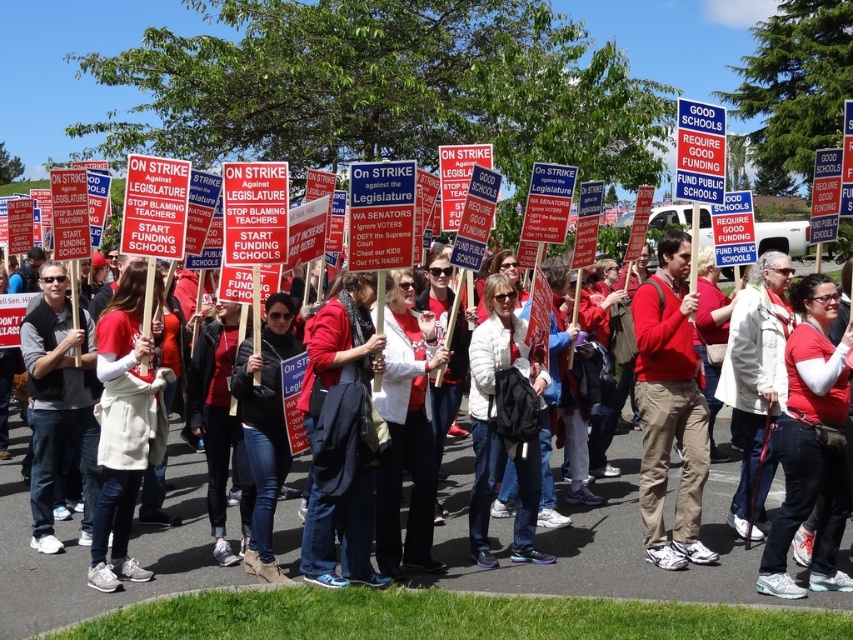
Does matte red sweater at center have a lesser height compared to gray vest at center?

No.

Can you confirm if matte red sweater at center is bigger than gray vest at center?

Actually, matte red sweater at center might be smaller than gray vest at center.

Where is `matte red sweater at center`? This screenshot has width=853, height=640. matte red sweater at center is located at coordinates (670, 406).

This screenshot has width=853, height=640. In order to click on matte red sweater at center in this screenshot , I will do 670,406.

Is point (196, 566) positioned behind point (666, 300)?

No, (196, 566) is closer to viewer.

Between point (468, 560) and point (654, 401), which one is positioned in front?

Point (654, 401)

Which is in front, point (274, 531) or point (651, 493)?

Point (651, 493) is in front.

This screenshot has width=853, height=640. What are the coordinates of `matte red shirt at center` in the screenshot? It's located at pyautogui.click(x=605, y=547).

Which is more to the left, matte red jacket at center or gray vest at center?

Positioned to the left is gray vest at center.

What do you see at coordinates (341, 436) in the screenshot?
I see `matte red jacket at center` at bounding box center [341, 436].

In order to click on matte red jacket at center in this screenshot , I will do `click(341, 436)`.